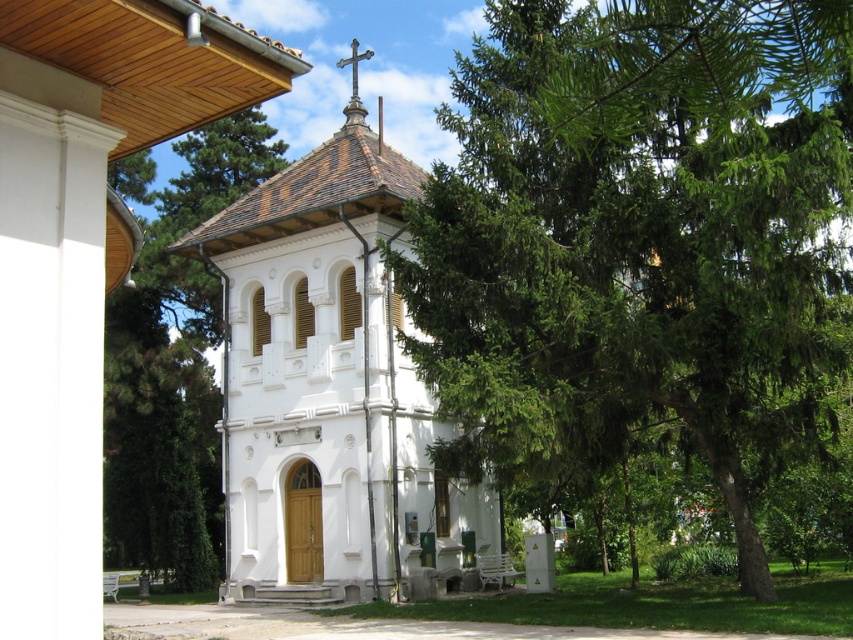
Question: Considering the relative positions of green leafy tree at center and white painted wood chapel at center in the image provided, where is green leafy tree at center located with respect to white painted wood chapel at center?

Choices:
 (A) right
 (B) left

Answer: (A)

Question: Which point is closer to the camera?

Choices:
 (A) green leafy tree at center
 (B) white painted wood chapel at center

Answer: (A)

Question: Does green leafy tree at center appear over white painted wood chapel at center?

Choices:
 (A) no
 (B) yes

Answer: (A)

Question: Considering the relative positions of green leafy tree at center and white painted wood chapel at center in the image provided, where is green leafy tree at center located with respect to white painted wood chapel at center?

Choices:
 (A) below
 (B) above

Answer: (A)